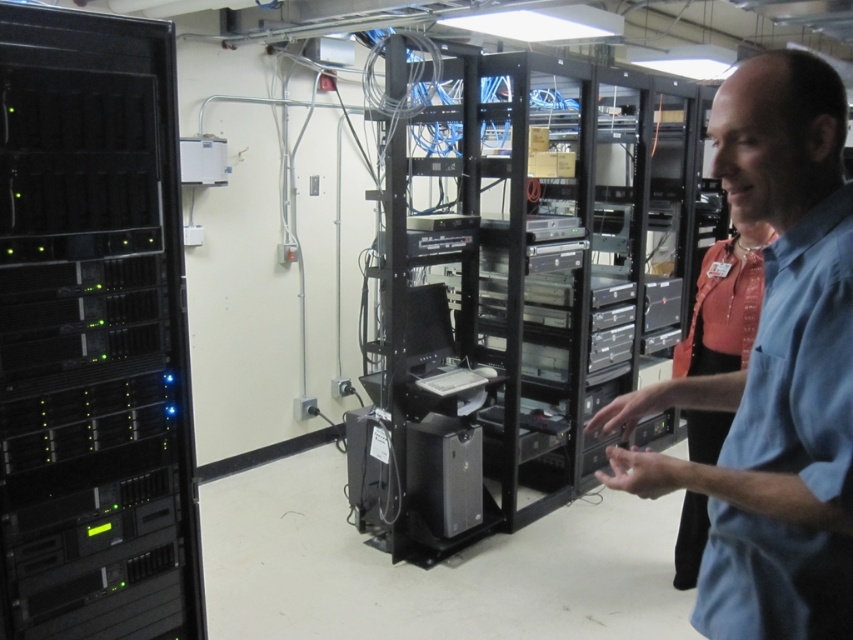
Is black metal server rack at center positioned in front of black metallic server at left?

No, it is behind black metallic server at left.

Between black metal server rack at center and black metallic server at left, which one appears on the left side from the viewer's perspective?

black metallic server at left is more to the left.

Does point (494, 365) come farther from viewer compared to point (85, 564)?

Yes, it is.

Locate an element on the screen. This screenshot has width=853, height=640. black metal server rack at center is located at coordinates (511, 282).

Does black metallic server at left lie in front of blue shirt at center?

No.

Where is `black metallic server at left`? black metallic server at left is located at coordinates (93, 333).

Identify the location of black metallic server at left. (93, 333).

I want to click on black metallic server at left, so click(x=93, y=333).

Between black metal server rack at center and blue shirt at center, which one has more height?

black metal server rack at center is taller.

Measure the distance between point [577,416] and camera.

A distance of 12.75 feet exists between point [577,416] and camera.

In order to click on black metal server rack at center in this screenshot , I will do `click(511, 282)`.